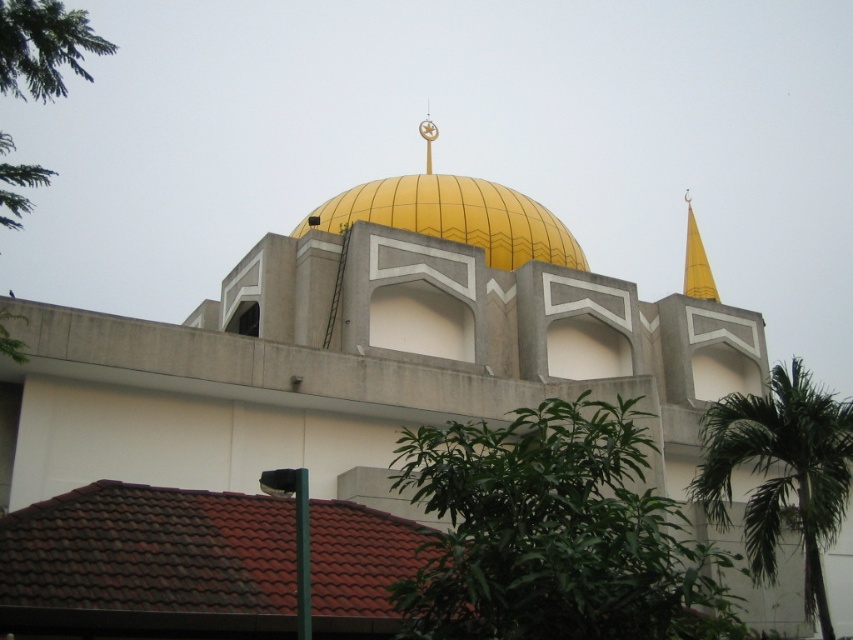
Between green leafy palm at right and yellow matte dome at center, which one has more height?

With more height is green leafy palm at right.

How far apart are green leafy palm at right and yellow matte dome at center?

The distance of green leafy palm at right from yellow matte dome at center is 22.31 meters.

Who is more distant from viewer, (830, 429) or (511, 202)?

Point (511, 202)

The width and height of the screenshot is (853, 640). I want to click on green leafy palm at right, so click(x=780, y=474).

Who is higher up, green leafy tree at left or yellow matte spire at upper center?

green leafy tree at left is above.

Based on the photo, does green leafy tree at left appear over yellow matte spire at upper center?

Yes, green leafy tree at left is above yellow matte spire at upper center.

Is point (56, 38) behind point (705, 291)?

No.

Identify the location of green leafy tree at left. (x=44, y=45).

Does green leafy tree at lower center appear on the right side of green leafy tree at left?

Yes, green leafy tree at lower center is to the right of green leafy tree at left.

Between green leafy tree at lower center and green leafy tree at left, which one is positioned higher?

green leafy tree at left is higher up.

Does point (531, 589) lie in front of point (55, 88)?

That is True.

Locate an element on the screen. green leafy tree at lower center is located at coordinates (553, 532).